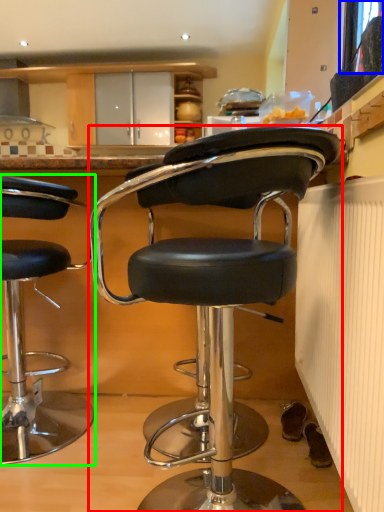
Question: Considering the real-world distances, which object is farthest from chair (highlighted by a red box)? window screen (highlighted by a blue box) or chair (highlighted by a green box)?

Choices:
 (A) window screen
 (B) chair

Answer: (A)